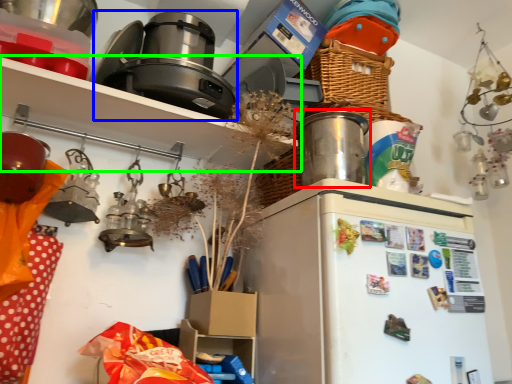
Question: Estimate the real-world distances between objects in this image. Which object is farther from appliance (highlighted by a red box), appliance (highlighted by a blue box) or shelf (highlighted by a green box)?

Choices:
 (A) appliance
 (B) shelf

Answer: (A)